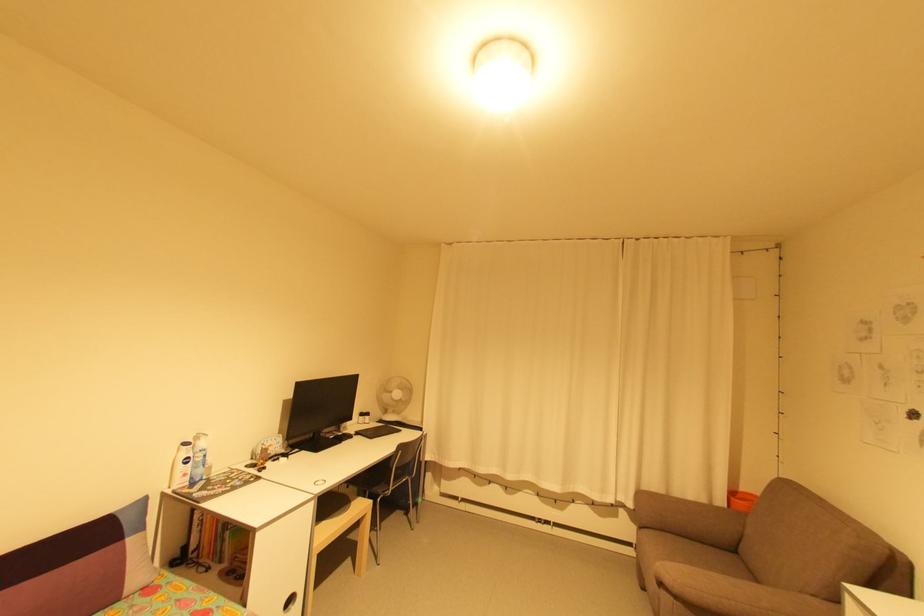
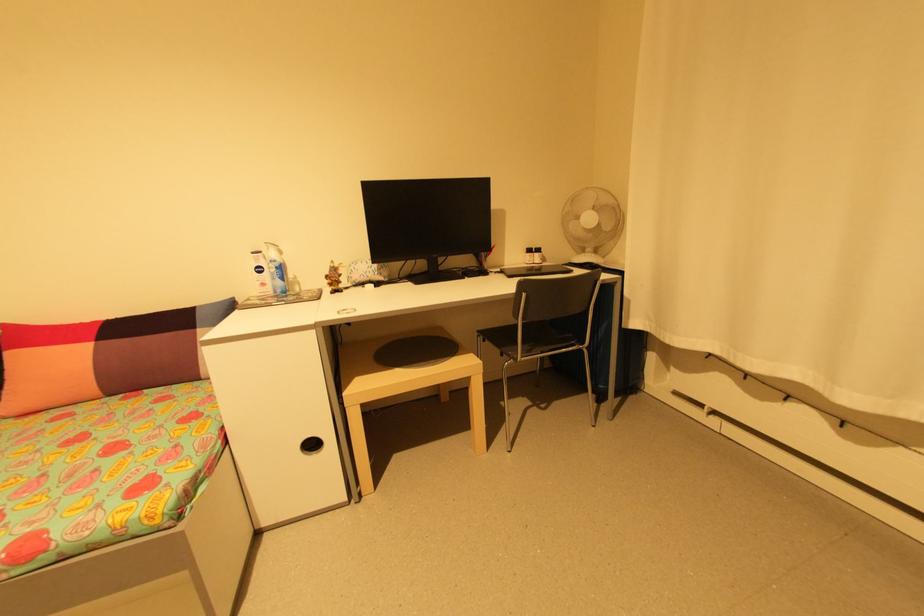
Find the pixel in the second image that matches pixel 272 447 in the first image.

(341, 265)